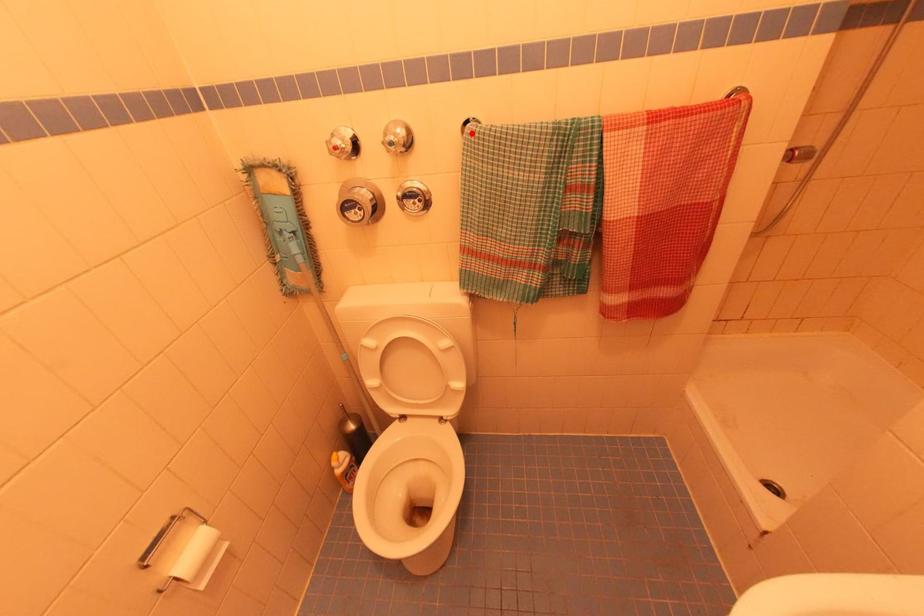
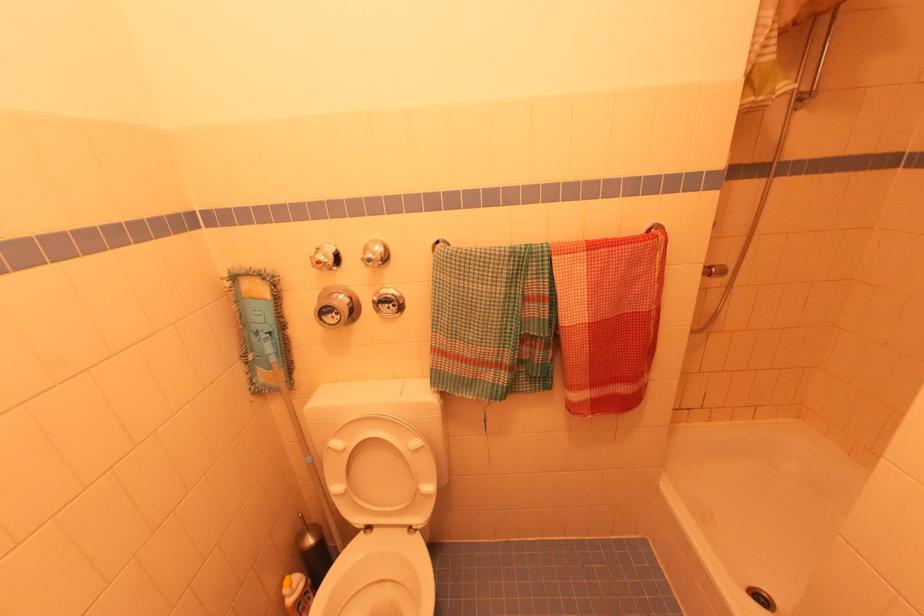
Locate, in the second image, the point that corresponds to the highlighted location in the first image.

(441, 253)